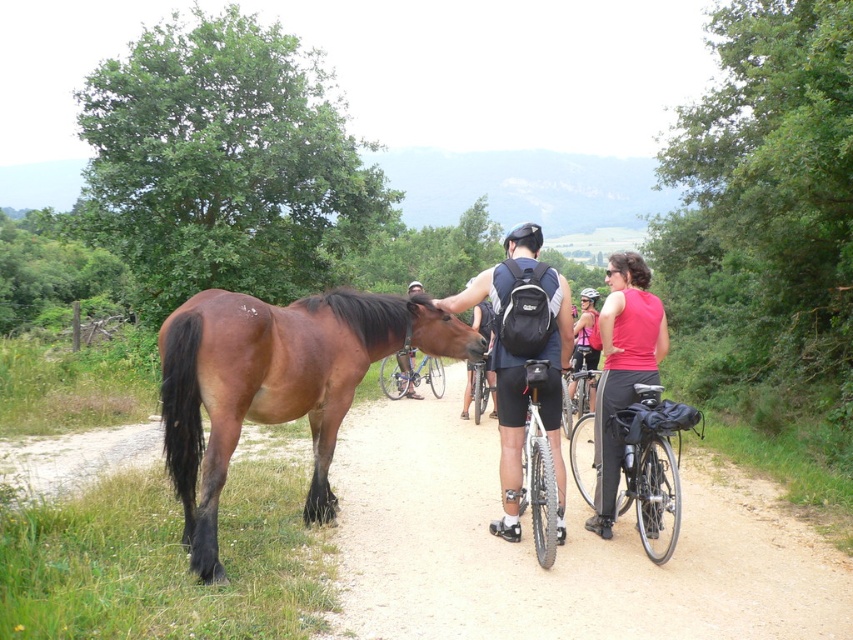
You are a cyclist who wants to carry both the brown leather bicycle at center and the black matte bicycle helmet at center in your backpack. Given that the backpack has limited space, which item should you place first to ensure both fit properly?

The brown leather bicycle at center is smaller than the black matte bicycle helmet at center, so you should place the black matte bicycle helmet at center first to make space for the smaller item.

You are a cyclist trying to decide which item to place in your backpack. You have a brown leather bicycle at center and a black matte bicycle helmet at center. Which item is narrower and can fit better in your backpack?

The brown leather bicycle at center has a lesser width compared to the black matte bicycle helmet at center, so it can fit better in the backpack.